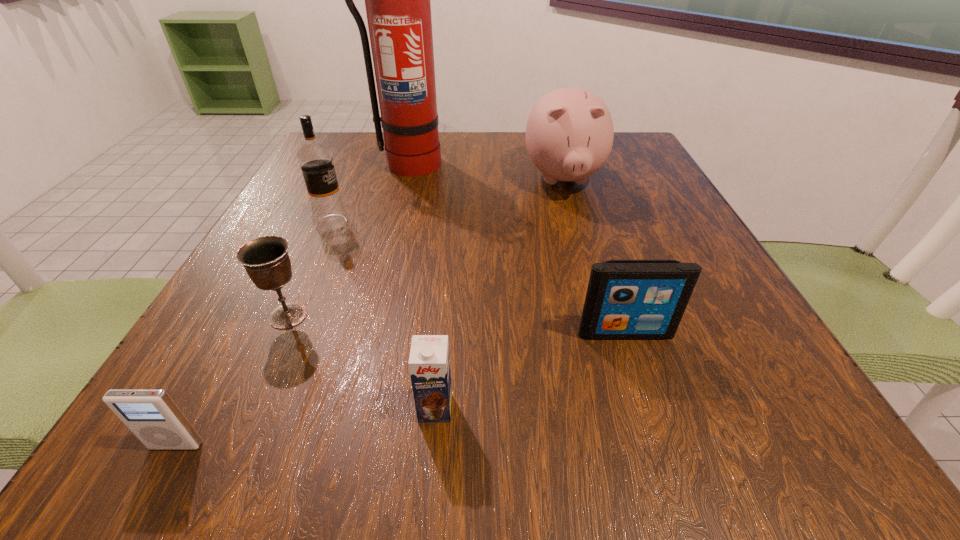
At what (x,y) coordinates should I click in order to perform the action: click on free spot located 0.170m on the label side of the tallest object. Please return your answer as a coordinate pair (x, y). Image resolution: width=960 pixels, height=540 pixels. Looking at the image, I should click on (392, 219).

At what (x,y) coordinates should I click in order to perform the action: click on free location located 0.370m on the label of the vodka. Please return your answer as a coordinate pair (x, y). The height and width of the screenshot is (540, 960). Looking at the image, I should click on (541, 223).

I want to click on vacant space located 0.220m at the snout of the piggy bank, so click(592, 281).

Where is `blank space located 0.140m on the front screen of the farther iPod`? Image resolution: width=960 pixels, height=540 pixels. blank space located 0.140m on the front screen of the farther iPod is located at coordinates (658, 431).

Identify the location of free space located 0.310m on the back of the chalice. Image resolution: width=960 pixels, height=540 pixels. [x=342, y=197].

Where is `fire extinguisher that is at the far edge`? This screenshot has width=960, height=540. fire extinguisher that is at the far edge is located at coordinates (397, 0).

Find the location of a particular element. piggy bank positioned at the far edge is located at coordinates (569, 134).

Identify the location of chocolate milk situated at the near edge. The image size is (960, 540). (429, 363).

Identify the location of iPod situated at the near edge. (151, 415).

Where is `fire extinguisher present at the left edge`? The height and width of the screenshot is (540, 960). fire extinguisher present at the left edge is located at coordinates (397, 0).